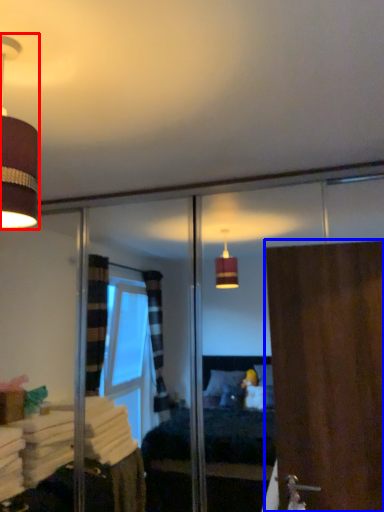
Question: Which point is closer to the camera, lamp (highlighted by a red box) or door (highlighted by a blue box)?

Choices:
 (A) lamp
 (B) door

Answer: (A)